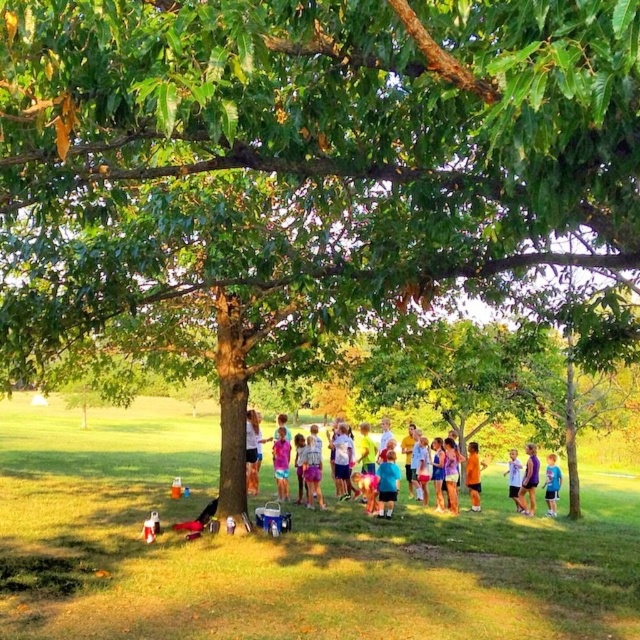
Question: Which object is the closest to the green grass at lower center?

Choices:
 (A) white cotton shirt at center
 (B) purple cotton shirt at lower right
 (C) orange fabric at center
 (D) blue cotton shirt at lower right

Answer: (B)

Question: Does multicolored casual clothing at center appear under purple cotton shirt at lower right?

Choices:
 (A) yes
 (B) no

Answer: (B)

Question: Estimate the real-world distances between objects in this image. Which object is farther from the multicolored casual clothing at center?

Choices:
 (A) purple cotton shirt at center
 (B) blue cotton shirt at lower right
 (C) orange fabric at center

Answer: (B)

Question: Which object is closer to the camera taking this photo?

Choices:
 (A) orange fabric at center
 (B) blue cotton shirt at lower right

Answer: (A)

Question: Can you confirm if green grass at lower center is thinner than orange fabric at center?

Choices:
 (A) no
 (B) yes

Answer: (A)

Question: Considering the relative positions of purple cotton shirt at lower right and purple cotton shirt at center in the image provided, where is purple cotton shirt at lower right located with respect to purple cotton shirt at center?

Choices:
 (A) left
 (B) right

Answer: (B)